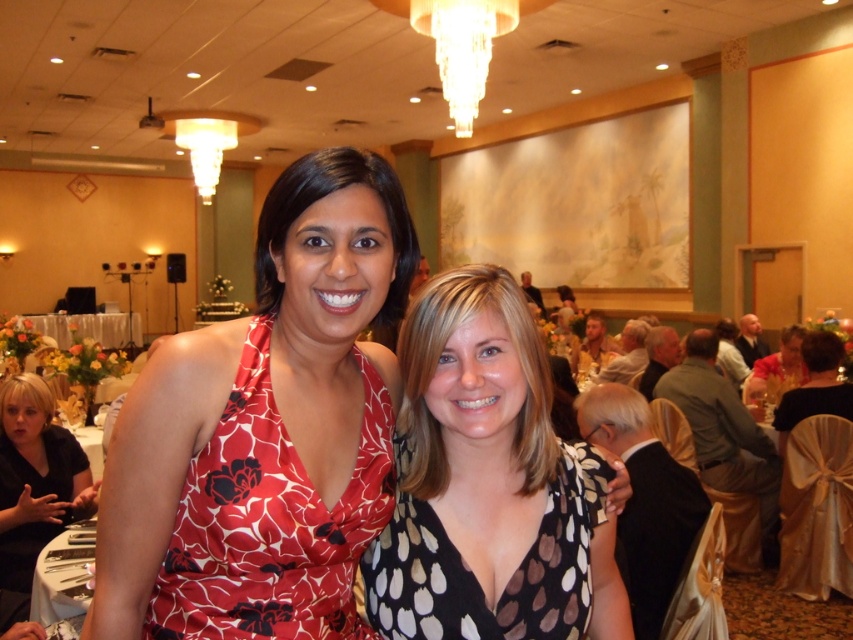
Question: Is floral print dress at center positioned in front of matte black dress at center?

Choices:
 (A) no
 (B) yes

Answer: (B)

Question: Based on their relative distances, which object is farther from the floral dress at center?

Choices:
 (A) matte black dress at center
 (B) red floral fabric dress at center
 (C) floral print dress at center

Answer: (B)

Question: Which object appears farthest from the camera in this image?

Choices:
 (A) black dotted dress at center
 (B) floral print dress at center
 (C) floral dress at center
 (D) matte black dress at center

Answer: (D)

Question: Among these objects, which one is nearest to the camera?

Choices:
 (A) floral print dress at center
 (B) black dotted dress at center
 (C) matte black dress at center

Answer: (A)

Question: Is black matte dress at lower left bigger than floral dress at center?

Choices:
 (A) no
 (B) yes

Answer: (A)

Question: In this image, where is floral print dress at center located relative to matte black dress at center?

Choices:
 (A) left
 (B) right

Answer: (A)